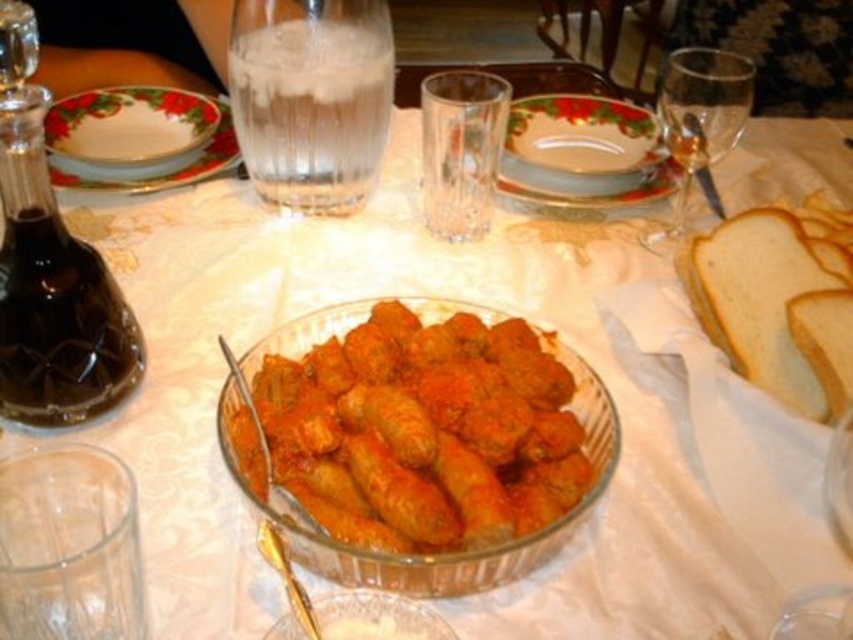
You are a guest at the table and want to reach both the white soft bread at right and the decorative ceramic plate at upper left. Which item is closer to you?

The white soft bread at right is closer to you because it is positioned under the decorative ceramic plate at upper left, meaning it is in front of the plate and thus nearer to your position.

Consider the image. You are a guest at a dinner party and want to reach for both the golden brown breaded rolls at center and the decorative ceramic plate at upper left. Which item will you need to move first to access the other?

The golden brown breaded rolls at center is closer to you than the decorative ceramic plate at upper left, so you would need to move the golden brown breaded rolls at center first to access the decorative ceramic plate at upper left.

You are a guest at the table and want to reach for the transparent glass wine glass at upper right and the gold metallic spoon at center. Which object is taller?

The transparent glass wine glass at upper right is much taller than the gold metallic spoon at center.